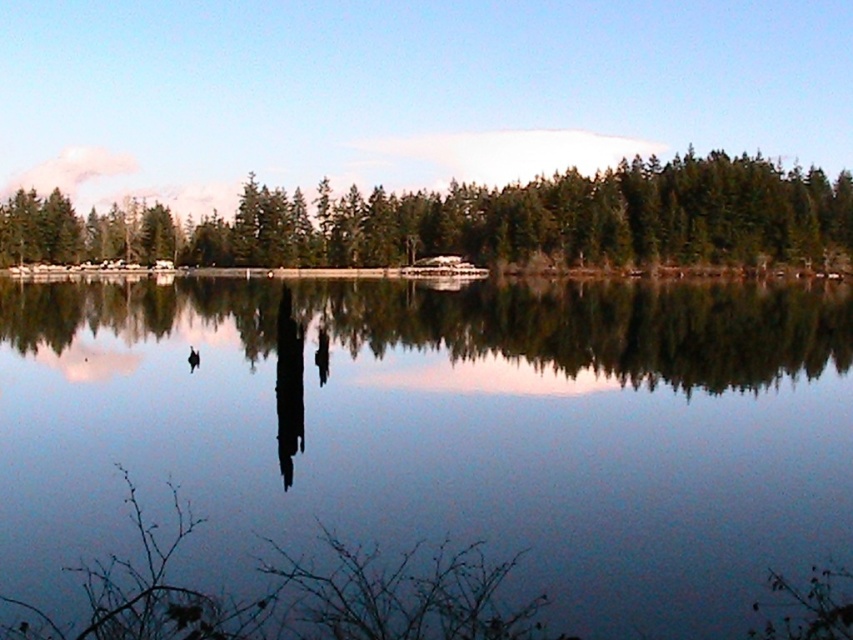
Describe the element at coordinates (477, 221) in the screenshot. I see `green matte trees at center` at that location.

Measure the distance between point (204, 252) and camera.

The distance of point (204, 252) from camera is 412.94 feet.

Measure the distance between point (663, 250) and camera.

101.26 meters

At what (x,y) coordinates should I click in order to perform the action: click on green matte trees at center. Please return your answer as a coordinate pair (x, y). This screenshot has width=853, height=640. Looking at the image, I should click on click(477, 221).

Is transparent water at center to the right of white plastic boat at center from the viewer's perspective?

In fact, transparent water at center is to the left of white plastic boat at center.

Is transparent water at center thinner than white plastic boat at center?

In fact, transparent water at center might be wider than white plastic boat at center.

Does point (386, 515) come behind point (457, 262)?

That is False.

Locate an element on the screen. The image size is (853, 640). transparent water at center is located at coordinates (440, 432).

Who is taller, transparent water at center or green matte trees at center?

green matte trees at center

Can you confirm if transparent water at center is smaller than green matte trees at center?

Answer: Correct, transparent water at center occupies less space than green matte trees at center.

Between point (111, 404) and point (440, 196), which one is positioned in front?

Positioned in front is point (111, 404).

Locate an element on the screen. transparent water at center is located at coordinates (440, 432).